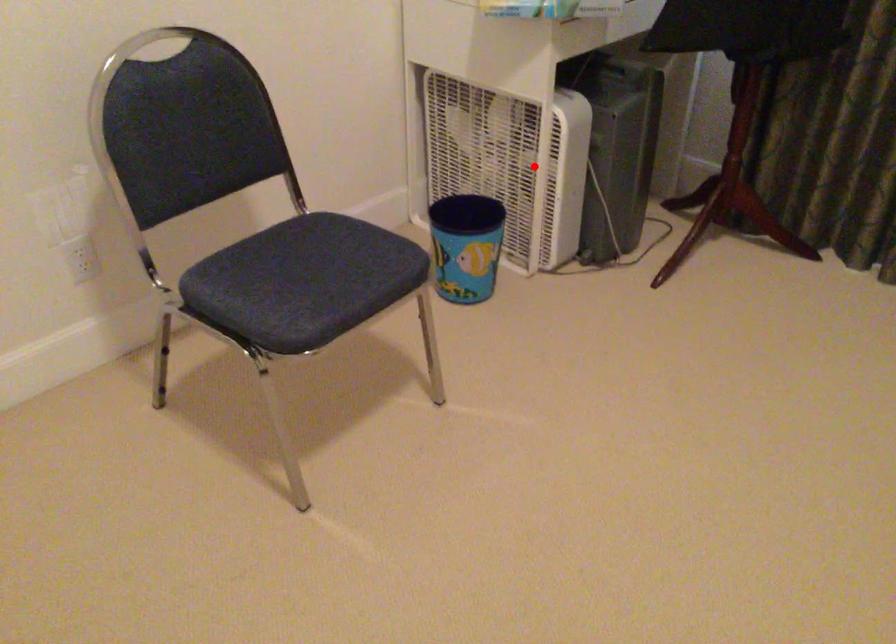
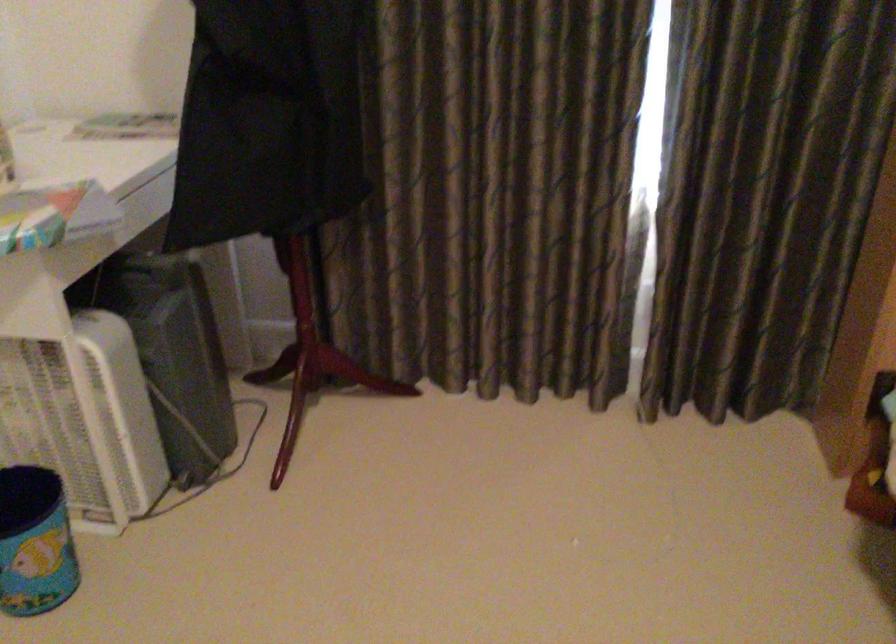
Where in the second image is the point corresponding to the highlighted location from the first image?

(82, 413)